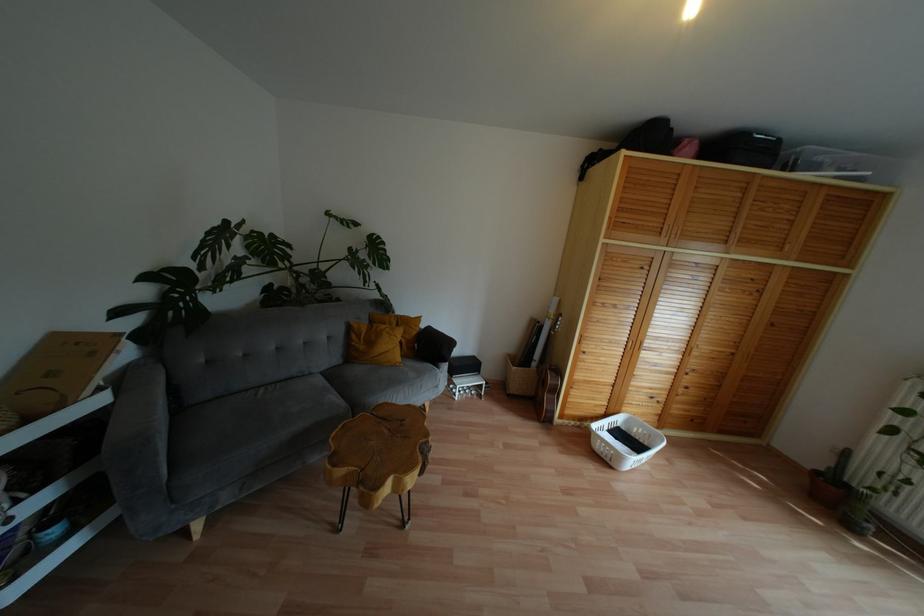
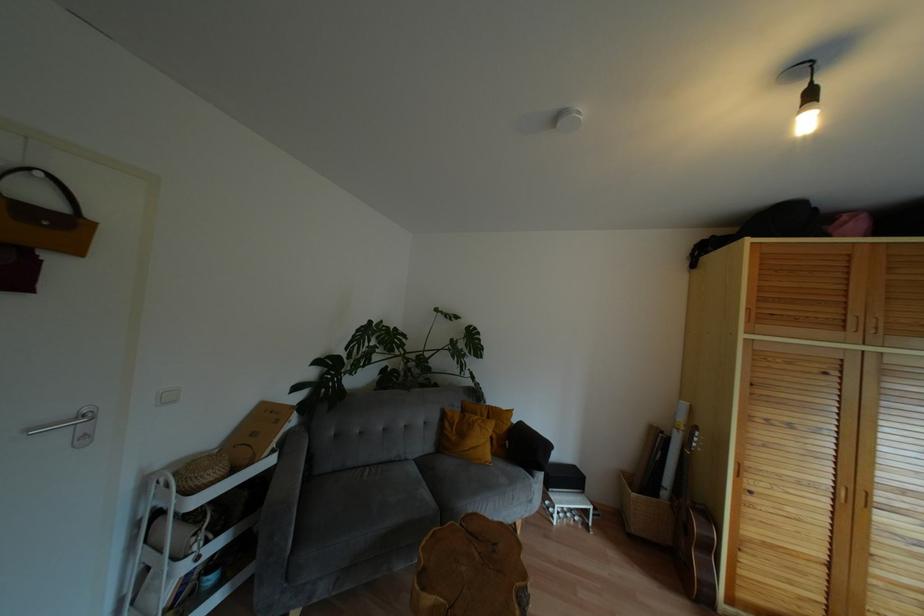
Locate, in the second image, the point that corresponds to the point at 397,359 in the first image.

(488, 456)